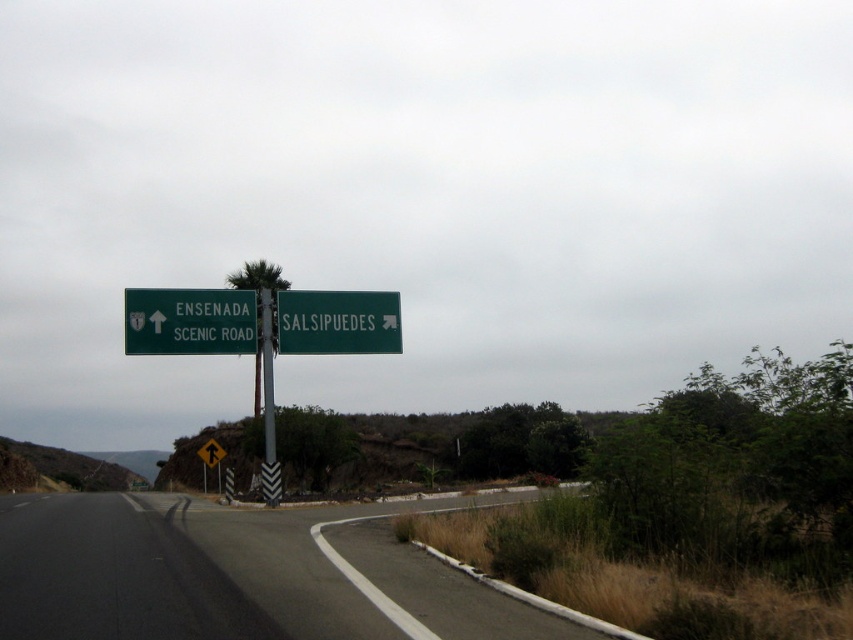
Question: Which of the following is the closest to the observer?

Choices:
 (A) (198, 452)
 (B) (247, 332)
 (C) (264, 392)
 (D) (334, 326)

Answer: (B)

Question: Is green matte sign at upper center to the right of yellow reflective plastic pedestrian crossing sign at upper center from the viewer's perspective?

Choices:
 (A) yes
 (B) no

Answer: (A)

Question: Does metallic pole at center have a larger size compared to yellow reflective plastic pedestrian crossing sign at upper center?

Choices:
 (A) yes
 (B) no

Answer: (B)

Question: Which point is farther to the camera?

Choices:
 (A) yellow reflective plastic pedestrian crossing sign at upper center
 (B) green matte sign at upper center
 (C) black asphalt road at center

Answer: (A)

Question: Can you confirm if green matte sign at upper left is thinner than yellow reflective plastic pedestrian crossing sign at upper center?

Choices:
 (A) yes
 (B) no

Answer: (A)

Question: Which is farther from the yellow reflective plastic pedestrian crossing sign at upper center?

Choices:
 (A) metallic pole at center
 (B) green matte sign at upper left

Answer: (B)